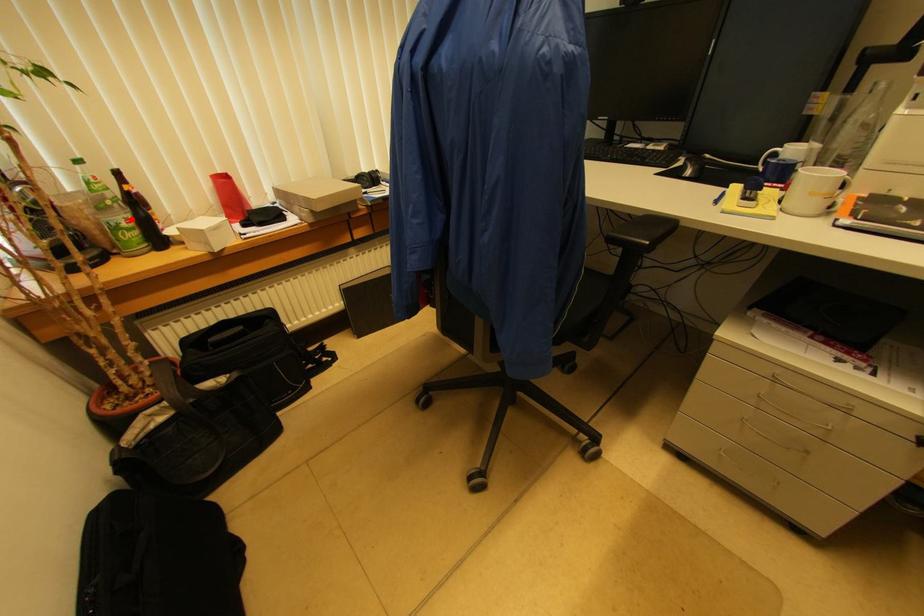
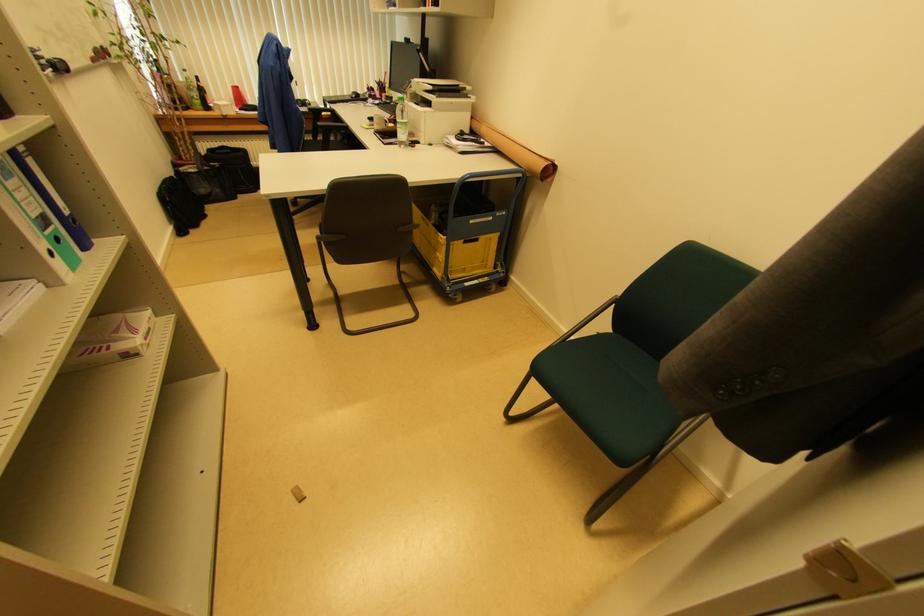
Question: I am providing you with two images of the same scene from different viewpoints. A red point is marked on the first image. Can you still see the location of the red point in image 2?

Choices:
 (A) Yes
 (B) No

Answer: (A)